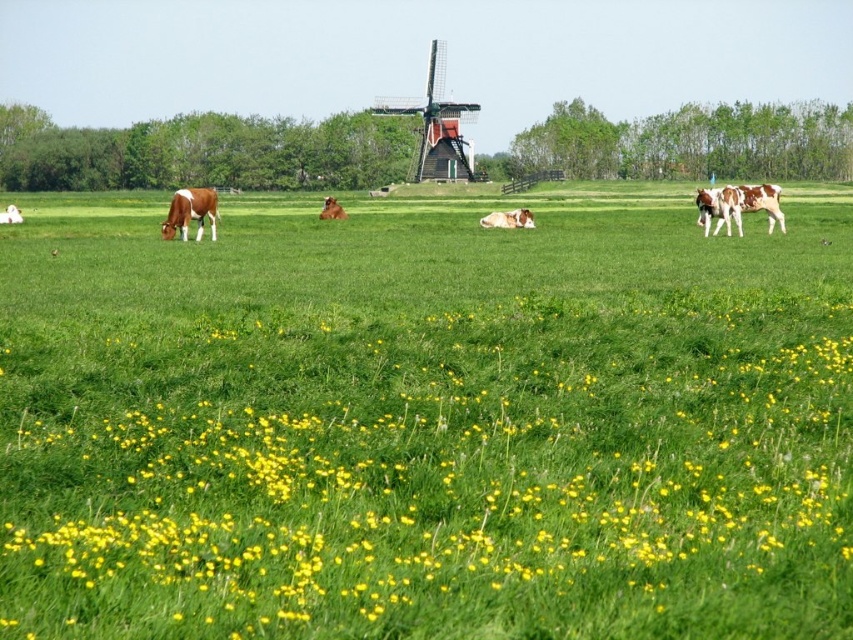
You are a farmer checking the health of your cows. You notice the brown glossy cow at left and the brown furry cow at center. Which cow might be an adult based on their height?

The brown glossy cow at left is much taller than the brown furry cow at center, so the brown glossy cow at left is likely the adult.

You are a farmer checking the health of your cows. You notice the brown glossy cow at center and the brown furry cow at center. Which cow might be younger based on their size?

The brown glossy cow at center has a smaller size compared to the brown furry cow at center, so it might be younger.

In the scene shown: You are standing at the origin point of the coordinate system in this image. The brown glossy cow at left is located at point (190, 212). If you want to walk towards the brown glossy cow at left, in which direction should you move? The coordinate system has the origin at the bottom left corner of the image, with the x and y axes increasing to the right and upwards respectively.

To move towards the brown glossy cow at left located at point (190, 212) from the origin, you should move northeast. This is because the x coordinate is positive to the right and the y coordinate is positive upwards, so moving northeast would align with both increasing x and y values.